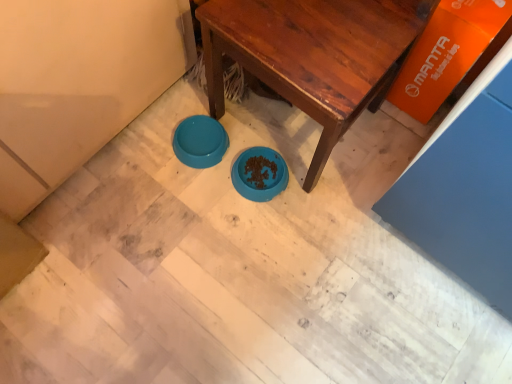
Where is `free point below wooden table at center (from a real-world perspective)`? free point below wooden table at center (from a real-world perspective) is located at coordinates (281, 127).